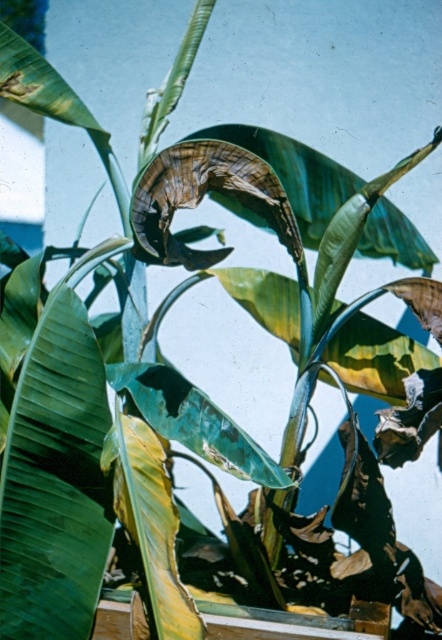
Question: Which point is farther to the camera?

Choices:
 (A) green matte banana leaf at center
 (B) green matte leaf at center

Answer: (B)

Question: Is green matte leaf at center in front of green matte banana leaf at center?

Choices:
 (A) yes
 (B) no

Answer: (B)

Question: Is green matte leaf at center above green matte banana leaf at center?

Choices:
 (A) yes
 (B) no

Answer: (A)

Question: Which point is farther to the camera?

Choices:
 (A) (114, 429)
 (B) (65, 342)

Answer: (A)

Question: Is green matte leaf at center smaller than green matte banana leaf at center?

Choices:
 (A) no
 (B) yes

Answer: (A)